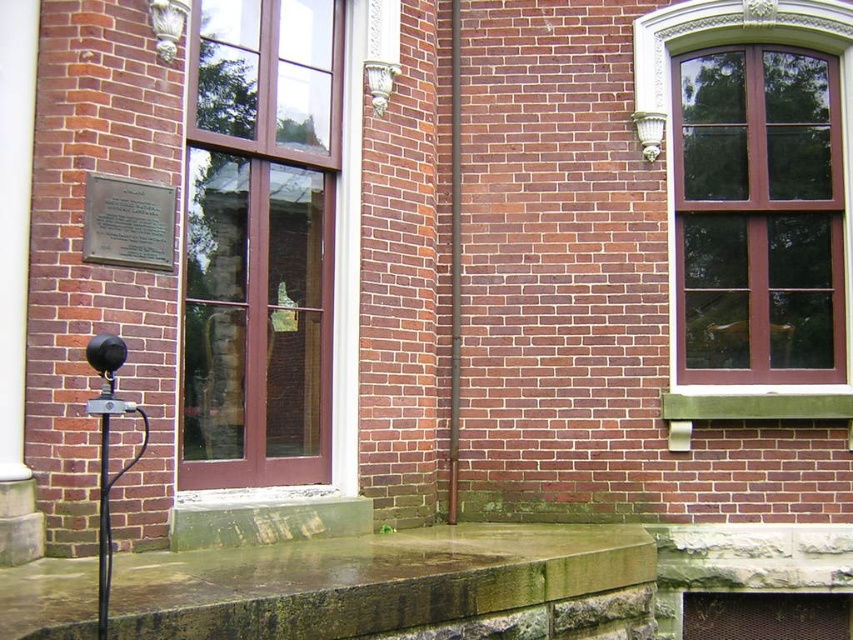
Question: Among these objects, which one is farthest from the camera?

Choices:
 (A) matte brown window at upper right
 (B) matte glass door at center
 (C) smooth brown pole at center

Answer: (C)

Question: Does green stone ledge at lower center have a lesser width compared to matte brown window at upper right?

Choices:
 (A) yes
 (B) no

Answer: (B)

Question: Is matte glass door at center smaller than smooth brown pole at center?

Choices:
 (A) no
 (B) yes

Answer: (A)

Question: Is matte glass door at center to the left of matte brown window at upper right from the viewer's perspective?

Choices:
 (A) yes
 (B) no

Answer: (A)

Question: Which of the following is the closest to the observer?

Choices:
 (A) metallic plaque at upper left
 (B) matte glass door at center
 (C) smooth brown pole at center

Answer: (A)

Question: Considering the real-world distances, which object is farthest from the metallic plaque at upper left?

Choices:
 (A) matte glass door at center
 (B) smooth brown pole at center
 (C) matte brown window at upper right

Answer: (C)